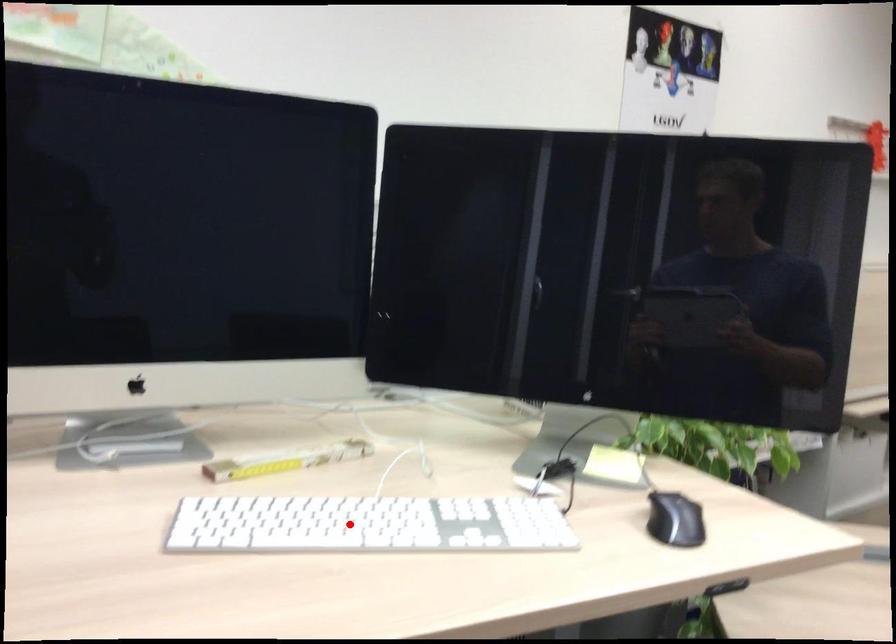
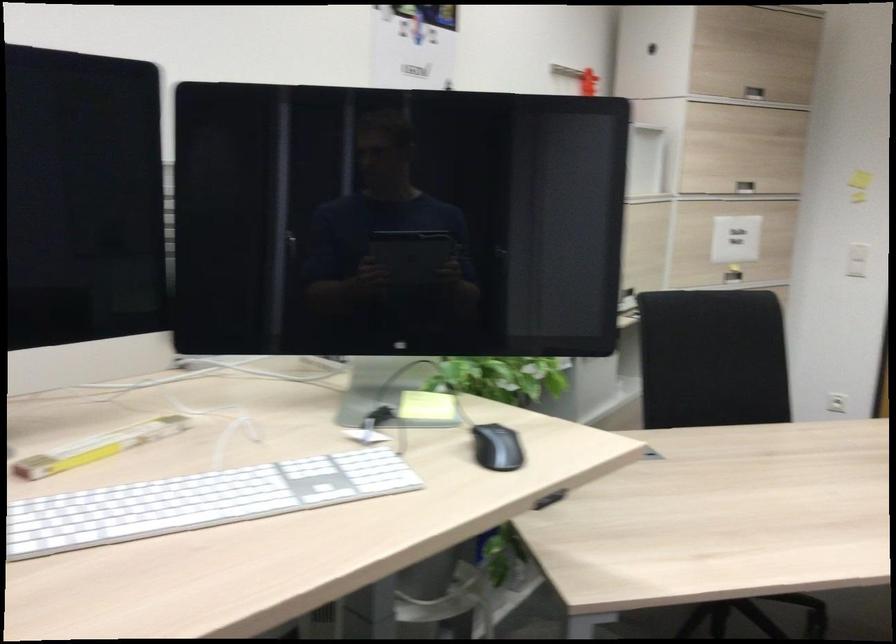
Find the pixel in the second image that matches the highlighted location in the first image.

(200, 500)